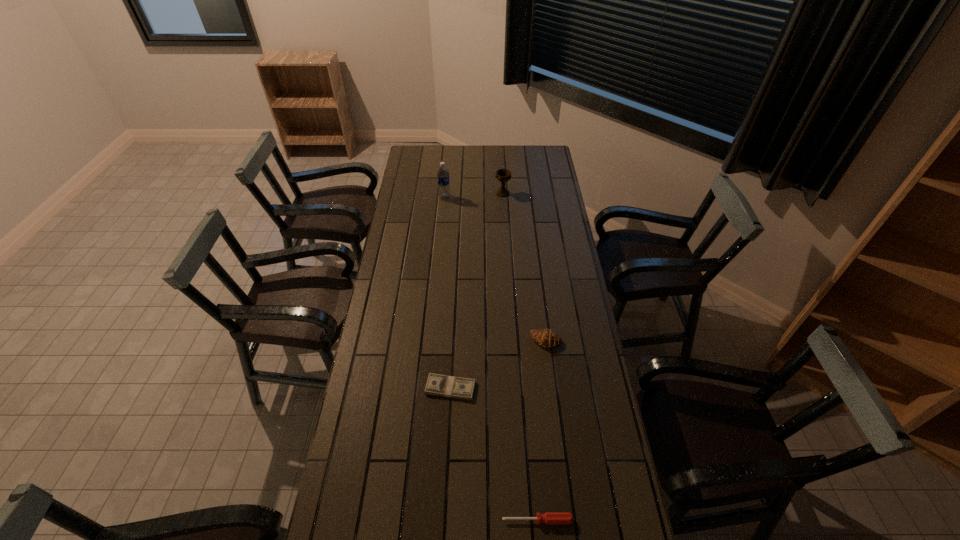
Locate an element on the screen. vacant space located 0.370m on the front of the crescent roll is located at coordinates (560, 450).

Identify the location of vacant area located on the back of the nearest object. The width and height of the screenshot is (960, 540). (536, 492).

Find the location of a particular element. This screenshot has width=960, height=540. free space located 0.330m on the front of the shortest object is located at coordinates (444, 508).

Where is `crescent roll situated at the right edge`? crescent roll situated at the right edge is located at coordinates (546, 338).

Locate an element on the screen. This screenshot has width=960, height=540. screwdriver present at the right edge is located at coordinates (549, 518).

The height and width of the screenshot is (540, 960). In the image, there is a desktop. In order to click on vacant space at the far edge in this screenshot , I will do coord(493,160).

Find the location of `blank space at the left edge`. blank space at the left edge is located at coordinates (400, 204).

In the image, there is a desktop. At what (x,y) coordinates should I click in order to perform the action: click on vacant space at the right edge. Please return your answer as a coordinate pair (x, y). Looking at the image, I should click on pyautogui.click(x=613, y=441).

Locate an element on the screen. Image resolution: width=960 pixels, height=540 pixels. unoccupied position between the nearest object and the shortest object is located at coordinates (494, 454).

Where is `vacant space that's between the screwdriver and the third shortest object`? vacant space that's between the screwdriver and the third shortest object is located at coordinates (541, 430).